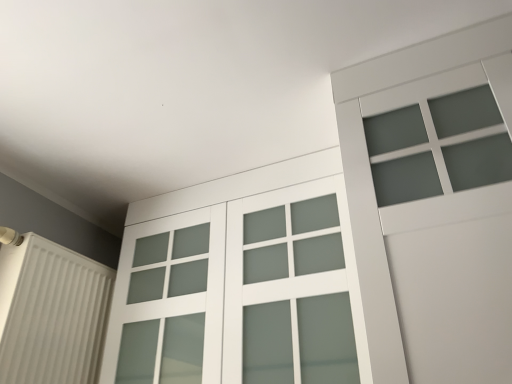
Question: From the image's perspective, would you say satin white glass door at center is shown under white matte radiator at left?

Choices:
 (A) no
 (B) yes

Answer: (A)

Question: Can you confirm if satin white glass door at center is shorter than white matte radiator at left?

Choices:
 (A) no
 (B) yes

Answer: (A)

Question: Is satin white glass door at center turned away from white matte radiator at left?

Choices:
 (A) yes
 (B) no

Answer: (B)

Question: Is satin white glass door at center directly adjacent to white matte radiator at left?

Choices:
 (A) yes
 (B) no

Answer: (B)

Question: Is satin white glass door at center taller than white matte radiator at left?

Choices:
 (A) no
 (B) yes

Answer: (B)

Question: Can you confirm if satin white glass door at center is thinner than white matte radiator at left?

Choices:
 (A) yes
 (B) no

Answer: (B)

Question: Is white matte radiator at left facing towards satin white glass door at center?

Choices:
 (A) no
 (B) yes

Answer: (B)

Question: Can you confirm if white matte radiator at left is taller than satin white glass door at center?

Choices:
 (A) yes
 (B) no

Answer: (B)

Question: Can you confirm if white matte radiator at left is bigger than satin white glass door at center?

Choices:
 (A) yes
 (B) no

Answer: (B)

Question: Considering the relative positions of white matte radiator at left and satin white glass door at center in the image provided, is white matte radiator at left behind satin white glass door at center?

Choices:
 (A) yes
 (B) no

Answer: (A)

Question: From the image's perspective, is white matte radiator at left located above satin white glass door at center?

Choices:
 (A) yes
 (B) no

Answer: (B)

Question: From a real-world perspective, is white matte radiator at left physically above satin white glass door at center?

Choices:
 (A) yes
 (B) no

Answer: (B)

Question: In terms of height, does satin white glass door at center look taller or shorter compared to white matte radiator at left?

Choices:
 (A) short
 (B) tall

Answer: (B)